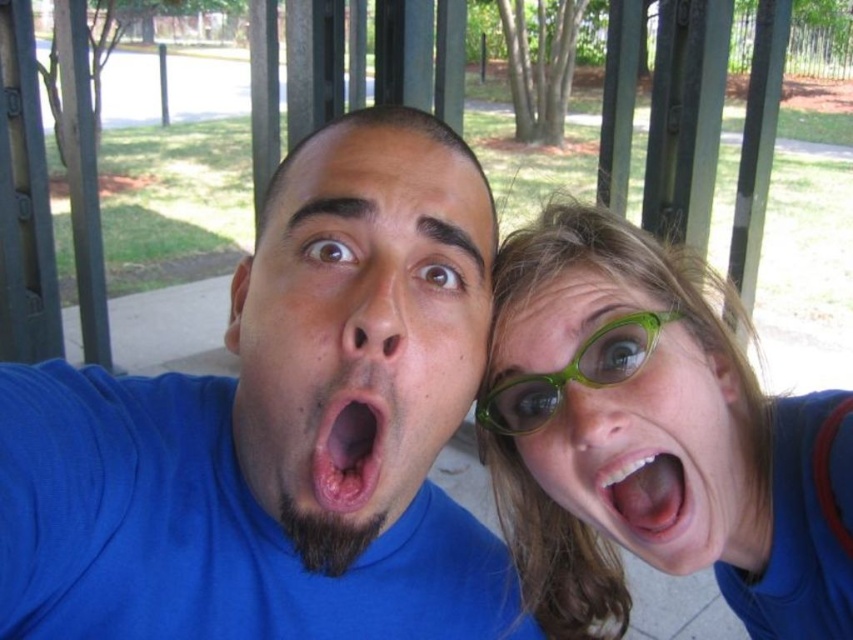
Question: Which of these objects is positioned closest to the pink flesh-colored lips at center?

Choices:
 (A) green plastic glasses at upper right
 (B) green plastic goggles at center
 (C) blue matte shirt at center
 (D) matte blue shirt at center

Answer: (D)

Question: Which object is positioned farthest from the green plastic glasses at upper right?

Choices:
 (A) green plastic glasses at center
 (B) pink flesh-colored lips at center
 (C) pink glossy lips at center

Answer: (B)

Question: Is blue matte shirt at center wider than pink flesh-colored lips at center?

Choices:
 (A) no
 (B) yes

Answer: (B)

Question: Estimate the real-world distances between objects in this image. Which object is closer to the pink glossy lips at center?

Choices:
 (A) green plastic glasses at center
 (B) green plastic goggles at center

Answer: (A)

Question: Is blue matte shirt at center below green plastic glasses at center?

Choices:
 (A) yes
 (B) no

Answer: (A)

Question: Can you confirm if matte blue shirt at center is positioned to the right of pink glossy lips at center?

Choices:
 (A) no
 (B) yes

Answer: (A)